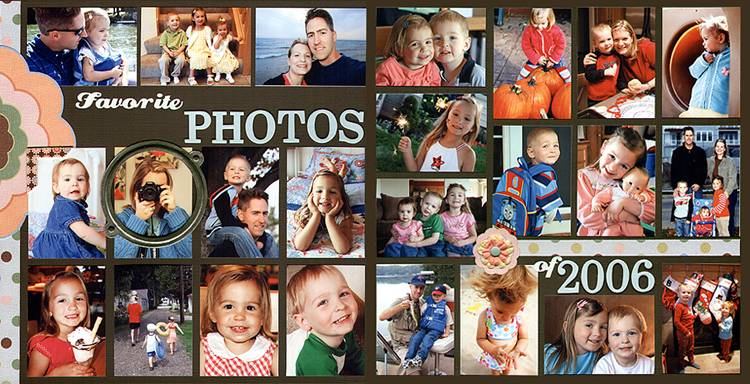
The image size is (750, 384). Identify the location of layers of decorative flowers. (4, 145), (15, 144), (38, 139), (54, 130), (494, 251), (495, 258), (506, 261), (502, 268).